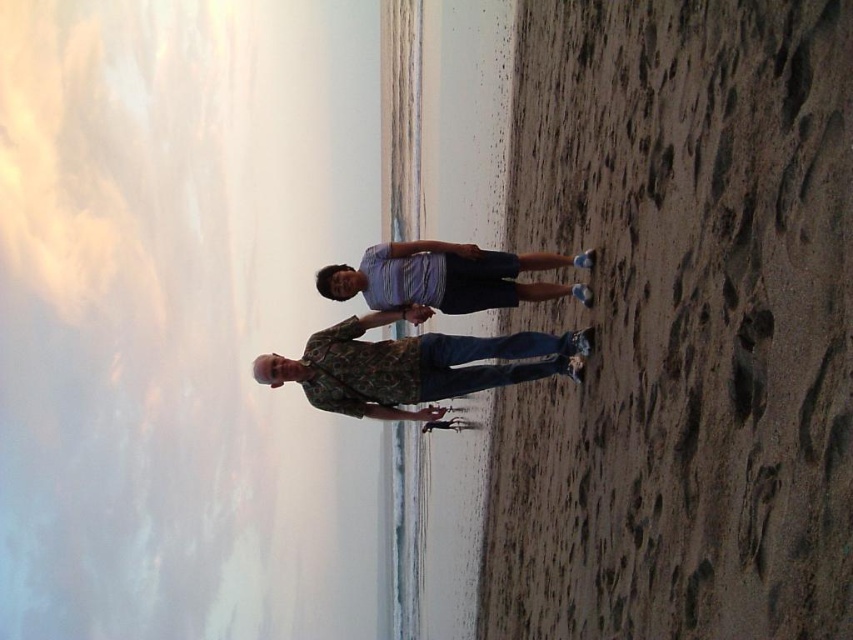
Can you confirm if camouflage-patterned shirt at center is taller than striped cotton shirt at center?

Correct, camouflage-patterned shirt at center is much taller as striped cotton shirt at center.

I want to click on camouflage-patterned shirt at center, so click(x=408, y=365).

The height and width of the screenshot is (640, 853). What are the coordinates of `camouflage-patterned shirt at center` in the screenshot? It's located at (408, 365).

Locate an element on the screen. camouflage-patterned shirt at center is located at coordinates (408, 365).